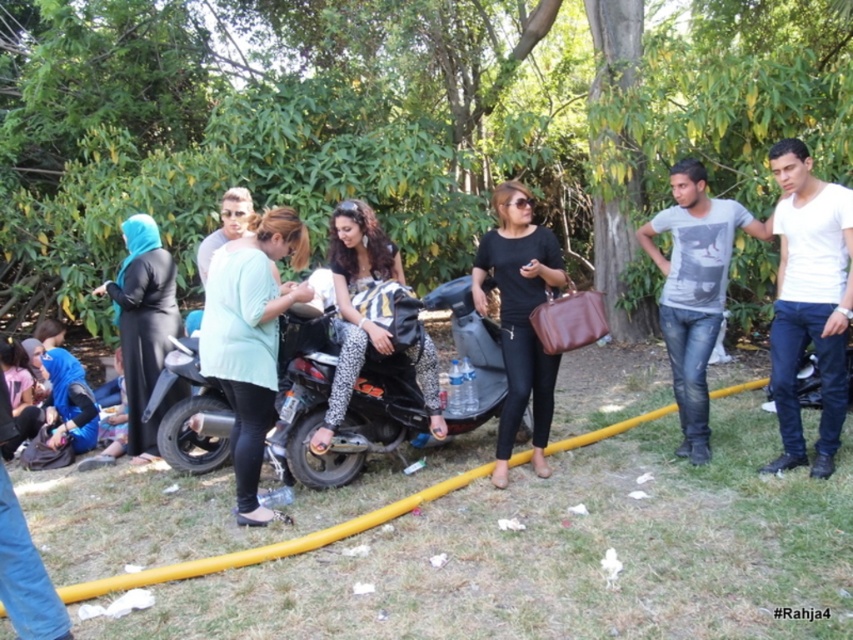
Question: Does white cotton shirt at right appear on the left side of blue matte hijab at left?

Choices:
 (A) no
 (B) yes

Answer: (A)

Question: Which object is closer to the camera taking this photo?

Choices:
 (A) black matte shirt at center
 (B) black matte motorcycle at center
 (C) leopard print leggings at center

Answer: (B)

Question: In this image, where is green matte shirt at center located relative to leopard print leggings at center?

Choices:
 (A) left
 (B) right

Answer: (A)

Question: Which object is positioned closest to the green matte shirt at center?

Choices:
 (A) blue matte hijab at left
 (B) light gray printed t-shirt at right
 (C) black matte motorcycle at center
 (D) leopard print leggings at center

Answer: (D)

Question: Is white cotton shirt at right to the left of black matte shirt at center from the viewer's perspective?

Choices:
 (A) no
 (B) yes

Answer: (A)

Question: Estimate the real-world distances between objects in this image. Which object is closer to the light gray printed t-shirt at right?

Choices:
 (A) leopard print leggings at center
 (B) blue matte hijab at left
 (C) white cotton shirt at right

Answer: (C)